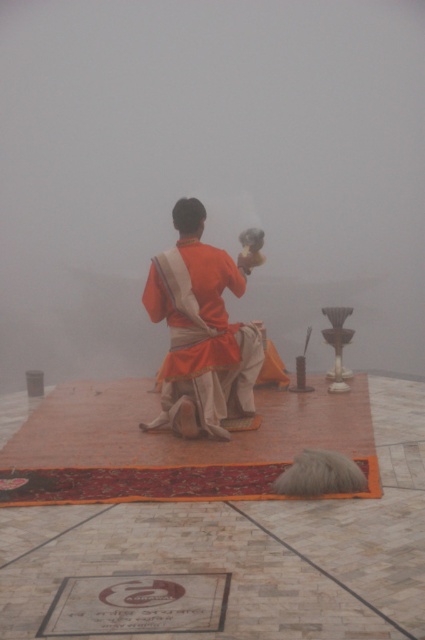
You are standing in the temple and see the point at coordinates (x=209, y=172). Based on the scene description, what is located at that point?

The point at coordinates (x=209, y=172) is on the foggy mist at center.

You are a photographer trying to capture the matte orange robe at center while avoiding the foggy mist at center. Based on their distance, can you estimate if you can focus on the robe without the mist blurring the image?

The foggy mist at center and matte orange robe at center are 4.17 meters apart. Since the mist is in the background and the robe is closer, the photographer can focus on the matte orange robe at center while keeping the foggy mist at center blurred in the background.